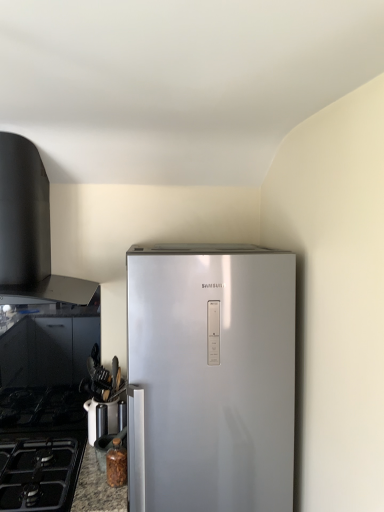
Measure the distance between point (91, 421) and camera.

The depth of point (91, 421) is 1.82 meters.

Image resolution: width=384 pixels, height=512 pixels. Identify the location of black matte vent at upper left. (30, 230).

This screenshot has height=512, width=384. What do you see at coordinates (96, 488) in the screenshot?
I see `granite countertop at lower left` at bounding box center [96, 488].

This screenshot has width=384, height=512. In order to click on metallic silver knife block at lower left in this screenshot , I will do `click(91, 419)`.

From a real-world perspective, who is located lower, black matte vent at upper left or metallic silver knife block at lower left?

In real-world perspective, metallic silver knife block at lower left is lower.

Between point (21, 199) and point (90, 430), which one is positioned in front?

The point (21, 199) is more forward.

Considering the positions of objects black matte vent at upper left and metallic silver knife block at lower left in the image provided, who is more to the right, black matte vent at upper left or metallic silver knife block at lower left?

Positioned to the right is metallic silver knife block at lower left.

Is granite countertop at lower left shorter than metallic silver knife block at lower left?

In fact, granite countertop at lower left may be taller than metallic silver knife block at lower left.

Is granite countertop at lower left thinner than metallic silver knife block at lower left?

No, granite countertop at lower left is not thinner than metallic silver knife block at lower left.

In the scene shown: Is granite countertop at lower left turned away from metallic silver knife block at lower left?

granite countertop at lower left does not have its back to metallic silver knife block at lower left.

Considering the points (124, 496) and (113, 424), which point is behind, point (124, 496) or point (113, 424)?

The point (113, 424) is more distant.

Is black matte gas stove at lower left inside the boundaries of metallic silver knife block at lower left, or outside?

black matte gas stove at lower left cannot be found inside metallic silver knife block at lower left.

Is black matte gas stove at lower left taller than metallic silver knife block at lower left?

In fact, black matte gas stove at lower left may be shorter than metallic silver knife block at lower left.

From a real-world perspective, is black matte gas stove at lower left above or below metallic silver knife block at lower left?

black matte gas stove at lower left is situated lower than metallic silver knife block at lower left in the real world.

What's the angular difference between black matte gas stove at lower left and granite countertop at lower left's facing directions?

The angular difference between black matte gas stove at lower left and granite countertop at lower left is 0.000114 degrees.

Considering the relative positions of black matte gas stove at lower left and granite countertop at lower left in the image provided, is black matte gas stove at lower left to the left of granite countertop at lower left from the viewer's perspective?

Yes, black matte gas stove at lower left is to the left of granite countertop at lower left.

From a real-world perspective, is black matte gas stove at lower left on granite countertop at lower left?

Correct, in the physical world, black matte gas stove at lower left is higher than granite countertop at lower left.

Which object is closer to the camera taking this photo, black matte gas stove at lower left or granite countertop at lower left?

Positioned in front is black matte gas stove at lower left.

Which object is wider, granite countertop at lower left or black matte vent at upper left?

With larger width is granite countertop at lower left.

In the scene shown: Which of these two, granite countertop at lower left or black matte vent at upper left, stands shorter?

Standing shorter between the two is granite countertop at lower left.

Are granite countertop at lower left and black matte vent at upper left located far from each other?

granite countertop at lower left is actually quite close to black matte vent at upper left.

From a real-world perspective, is granite countertop at lower left positioned over black matte vent at upper left based on gravity?

Incorrect, from a real-world perspective, granite countertop at lower left is lower than black matte vent at upper left.

Between metallic silver knife block at lower left and black matte vent at upper left, which one has smaller size?

metallic silver knife block at lower left.

Does point (90, 401) come closer to viewer compared to point (50, 296)?

Yes.

Is metallic silver knife block at lower left looking in the opposite direction of black matte vent at upper left?

No, black matte vent at upper left is not at the back of metallic silver knife block at lower left.

Which of these two, metallic silver knife block at lower left or black matte vent at upper left, stands taller?

black matte vent at upper left.

Is metallic silver knife block at lower left oriented away from granite countertop at lower left?

That's not correct — metallic silver knife block at lower left is not looking away from granite countertop at lower left.

Consider the image. From a real-world perspective, is metallic silver knife block at lower left under granite countertop at lower left?

No, from a real-world perspective, metallic silver knife block at lower left is not below granite countertop at lower left.

Considering the sizes of metallic silver knife block at lower left and granite countertop at lower left in the image, is metallic silver knife block at lower left wider or thinner than granite countertop at lower left?

Clearly, metallic silver knife block at lower left has less width compared to granite countertop at lower left.

This screenshot has width=384, height=512. I want to click on appliance below the black matte vent at upper left (from the image's perspective), so click(x=91, y=419).

Find the location of a particular element. This screenshot has width=384, height=512. appliance lying on the left of granite countertop at lower left is located at coordinates (91, 419).

Looking at the image, which one is located closer to black matte gas stove at lower left, granite countertop at lower left or metallic silver knife block at lower left?

granite countertop at lower left lies closer to black matte gas stove at lower left than the other object.

Estimate the real-world distances between objects in this image. Which object is further from black matte vent at upper left, metallic silver knife block at lower left or black matte gas stove at lower left?

metallic silver knife block at lower left is positioned further to the anchor black matte vent at upper left.

Based on their spatial positions, is black matte vent at upper left or metallic silver knife block at lower left closer to black matte gas stove at lower left?

Based on the image, metallic silver knife block at lower left appears to be nearer to black matte gas stove at lower left.

When comparing their distances from granite countertop at lower left, does black matte gas stove at lower left or metallic silver knife block at lower left seem closer?

metallic silver knife block at lower left is positioned closer to the anchor granite countertop at lower left.

When comparing their distances from granite countertop at lower left, does black matte vent at upper left or black matte gas stove at lower left seem further?

Among the two, black matte vent at upper left is located further to granite countertop at lower left.

Considering their positions, is black matte vent at upper left positioned further to metallic silver knife block at lower left than black matte gas stove at lower left?

Among the two, black matte vent at upper left is located further to metallic silver knife block at lower left.

Estimate the real-world distances between objects in this image. Which object is further from granite countertop at lower left, black matte gas stove at lower left or black matte vent at upper left?

black matte vent at upper left is further to granite countertop at lower left.

Estimate the real-world distances between objects in this image. Which object is closer to metallic silver knife block at lower left, black matte gas stove at lower left or granite countertop at lower left?

The object closer to metallic silver knife block at lower left is granite countertop at lower left.

Identify the location of gas stove between black matte vent at upper left and granite countertop at lower left vertically. (40, 447).

You are a GUI agent. You are given a task and a screenshot of the screen. Output one action in this format:
    pyautogui.click(x=<x>, y=<y>)
    Task: Click on the appliance between black matte vent at upper left and granite countertop at lower left vertically
    The height and width of the screenshot is (512, 384).
    Given the screenshot: What is the action you would take?
    pyautogui.click(x=91, y=419)

You are a GUI agent. You are given a task and a screenshot of the screen. Output one action in this format:
    pyautogui.click(x=<x>, y=<y>)
    Task: Click on the counter top positioned between black matte gas stove at lower left and metallic silver knife block at lower left from near to far
    This screenshot has height=512, width=384.
    Given the screenshot: What is the action you would take?
    pyautogui.click(x=96, y=488)

Locate an element on the screen. appliance between black matte vent at upper left and black matte gas stove at lower left from top to bottom is located at coordinates (91, 419).